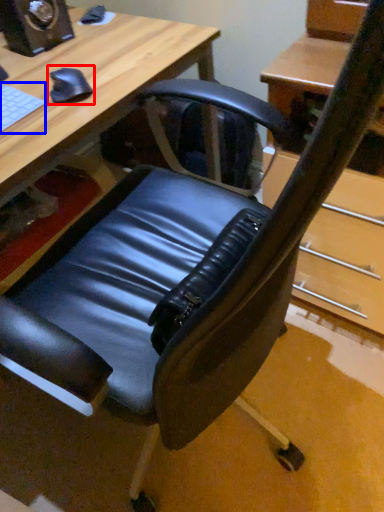
Question: Which object is closer to the camera taking this photo, mouse (highlighted by a red box) or laptop keyboard (highlighted by a blue box)?

Choices:
 (A) mouse
 (B) laptop keyboard

Answer: (B)